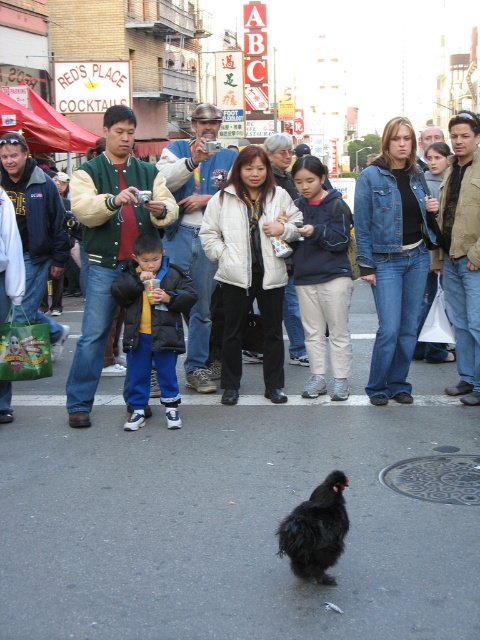
Question: Is matte black chicken at center above dark blue jacket at center?

Choices:
 (A) yes
 (B) no

Answer: (A)

Question: Considering the real-world distances, which object is farthest from the matte black chicken at center?

Choices:
 (A) black fluffy chicken at center
 (B) dark blue jacket at center

Answer: (A)

Question: Which object is closer to the camera taking this photo?

Choices:
 (A) matte black chicken at center
 (B) dark blue jacket at center

Answer: (B)

Question: Which object is the closest to the black fluffy chicken at center?

Choices:
 (A) dark blue jacket at center
 (B) matte black chicken at center

Answer: (A)

Question: Can you confirm if matte black chicken at center is wider than dark blue jacket at center?

Choices:
 (A) no
 (B) yes

Answer: (B)

Question: Considering the relative positions of dark blue jacket at center and black fluffy chicken at center in the image provided, where is dark blue jacket at center located with respect to black fluffy chicken at center?

Choices:
 (A) above
 (B) below

Answer: (A)